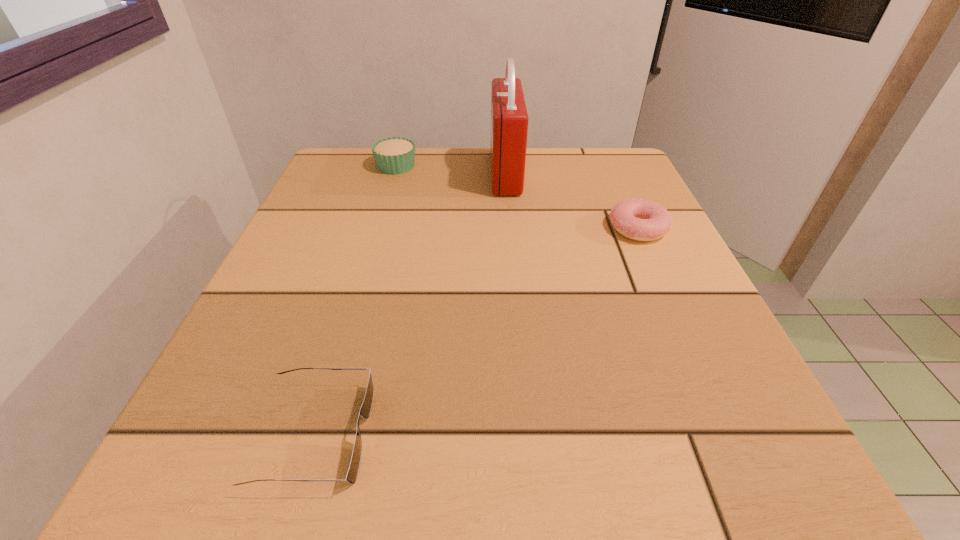
At what (x,y) coordinates should I click in order to perform the action: click on the second object from right to left. Please return your answer as a coordinate pair (x, y). The image size is (960, 540). Looking at the image, I should click on (509, 119).

Locate an element on the screen. The image size is (960, 540). the first-aid kit is located at coordinates (509, 119).

Find the location of a particular element. the third shortest object is located at coordinates (395, 155).

This screenshot has width=960, height=540. In order to click on the rightmost object in this screenshot , I will do `click(639, 219)`.

The height and width of the screenshot is (540, 960). I want to click on the second nearest object, so click(x=639, y=219).

Where is `sunglasses`? This screenshot has width=960, height=540. sunglasses is located at coordinates (365, 410).

This screenshot has width=960, height=540. What are the coordinates of `vacant space situated 0.140m on the front face of the tallest object` in the screenshot? It's located at (430, 173).

I want to click on free space located 0.120m on the front face of the tallest object, so (x=439, y=173).

Locate an element on the screen. vacant point located 0.070m on the front face of the tallest object is located at coordinates (461, 173).

The height and width of the screenshot is (540, 960). I want to click on vacant position located on the left of the cupcake, so click(332, 166).